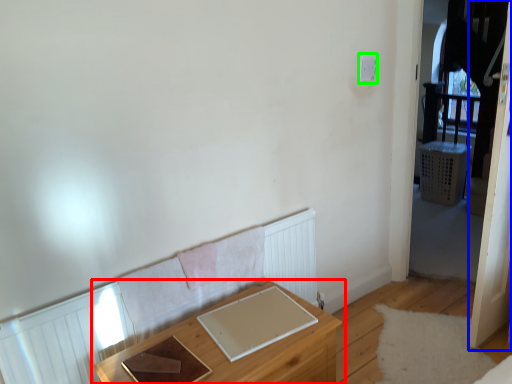
Question: Considering the real-world distances, which object is farthest from table (highlighted by a red box)? screen door (highlighted by a blue box) or light switch (highlighted by a green box)?

Choices:
 (A) screen door
 (B) light switch

Answer: (B)